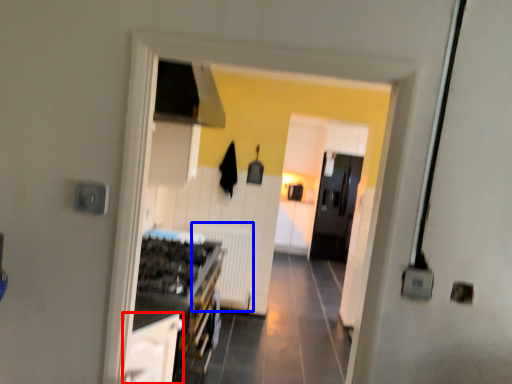
Question: Which of the following is the closest to the observer, cabinetry (highlighted by a red box) or radiator (highlighted by a blue box)?

Choices:
 (A) cabinetry
 (B) radiator

Answer: (A)